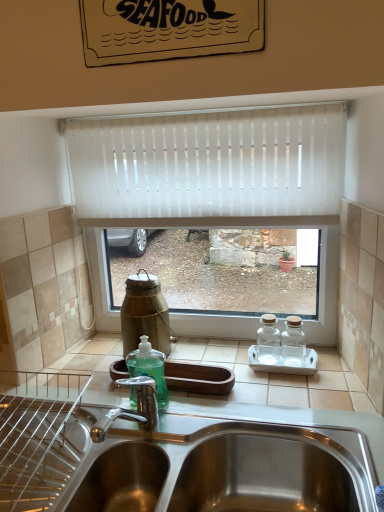
Question: From a real-world perspective, does green glass bottle at center sit lower than white vertical blinds at center?

Choices:
 (A) no
 (B) yes

Answer: (B)

Question: Does green glass bottle at center lie in front of white vertical blinds at center?

Choices:
 (A) no
 (B) yes

Answer: (A)

Question: Could you tell me if green glass bottle at center is facing white vertical blinds at center?

Choices:
 (A) no
 (B) yes

Answer: (A)

Question: Is green glass bottle at center at the left side of white vertical blinds at center?

Choices:
 (A) no
 (B) yes

Answer: (B)

Question: Does green glass bottle at center have a greater width compared to white vertical blinds at center?

Choices:
 (A) yes
 (B) no

Answer: (A)

Question: Would you say green glass bottle at center is a long distance from white vertical blinds at center?

Choices:
 (A) no
 (B) yes

Answer: (A)

Question: Can you confirm if white vertical blinds at center is bigger than green glass bottle at center?

Choices:
 (A) yes
 (B) no

Answer: (A)

Question: Is white vertical blinds at center far away from green glass bottle at center?

Choices:
 (A) no
 (B) yes

Answer: (A)

Question: From a real-world perspective, does white vertical blinds at center stand above green glass bottle at center?

Choices:
 (A) yes
 (B) no

Answer: (A)

Question: Is white vertical blinds at center oriented away from green glass bottle at center?

Choices:
 (A) yes
 (B) no

Answer: (B)

Question: Is white vertical blinds at center taller than green glass bottle at center?

Choices:
 (A) yes
 (B) no

Answer: (A)

Question: Can you confirm if white vertical blinds at center is wider than green glass bottle at center?

Choices:
 (A) no
 (B) yes

Answer: (A)

Question: Can you confirm if green glass bottle at center is shorter than stainless steel sink at lower center?

Choices:
 (A) yes
 (B) no

Answer: (B)